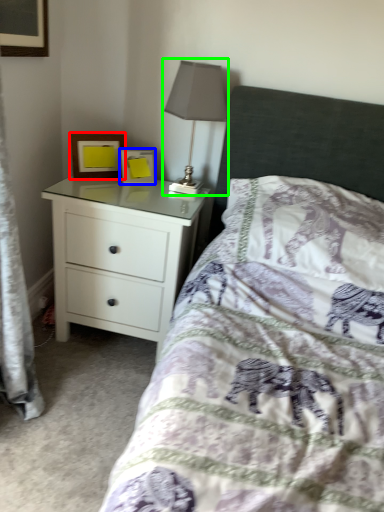
Question: Which is farther away from picture frame (highlighted by a red box)? picture frame (highlighted by a blue box) or table lamp (highlighted by a green box)?

Choices:
 (A) picture frame
 (B) table lamp

Answer: (B)